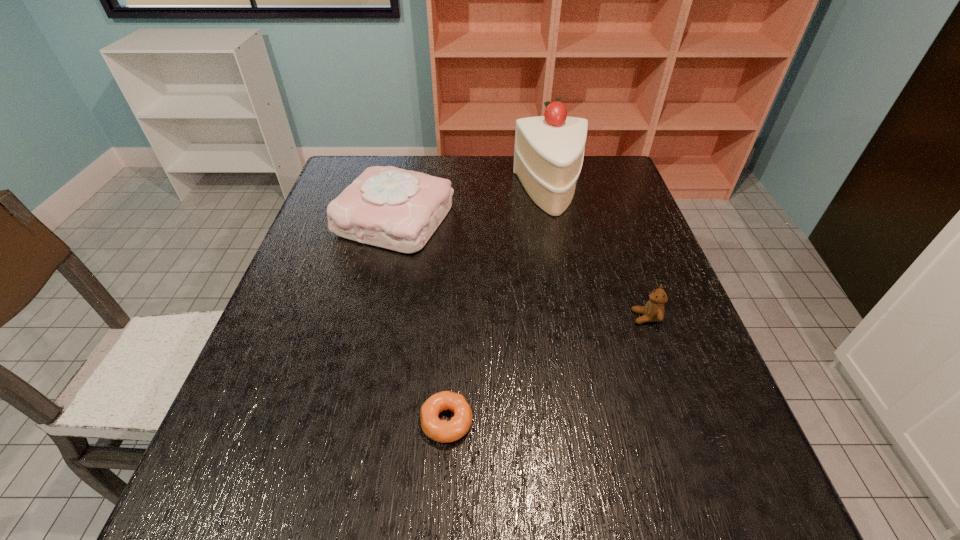
Image resolution: width=960 pixels, height=540 pixels. I want to click on the taller cake, so click(548, 155).

At what (x,y) coordinates should I click in order to perform the action: click on the right cake. Please return your answer as a coordinate pair (x, y). Looking at the image, I should click on (x=548, y=155).

Find the location of a particular element. This screenshot has height=540, width=960. the third shortest object is located at coordinates (388, 207).

Find the location of a particular element. Image resolution: width=960 pixels, height=540 pixels. the shorter cake is located at coordinates (388, 207).

The image size is (960, 540). Identify the location of teddy bear. (653, 311).

Locate an element on the screen. the third tallest object is located at coordinates (653, 311).

You are a GUI agent. You are given a task and a screenshot of the screen. Output one action in this format:
    pyautogui.click(x=<x>, y=<y>)
    Task: Click on the nearest object
    Image resolution: width=960 pixels, height=540 pixels.
    Given the screenshot: What is the action you would take?
    pyautogui.click(x=443, y=431)

The image size is (960, 540). I want to click on the shortest object, so (x=443, y=431).

Image resolution: width=960 pixels, height=540 pixels. I want to click on blank area located 0.310m on the left of the third object from left to right, so click(x=412, y=193).

You are a GUI agent. You are given a task and a screenshot of the screen. Output one action in this format:
    pyautogui.click(x=<x>, y=<y>)
    Task: Click on the vacant space located 0.160m on the back of the shorter cake
    This screenshot has height=540, width=960.
    Given the screenshot: What is the action you would take?
    pyautogui.click(x=409, y=161)